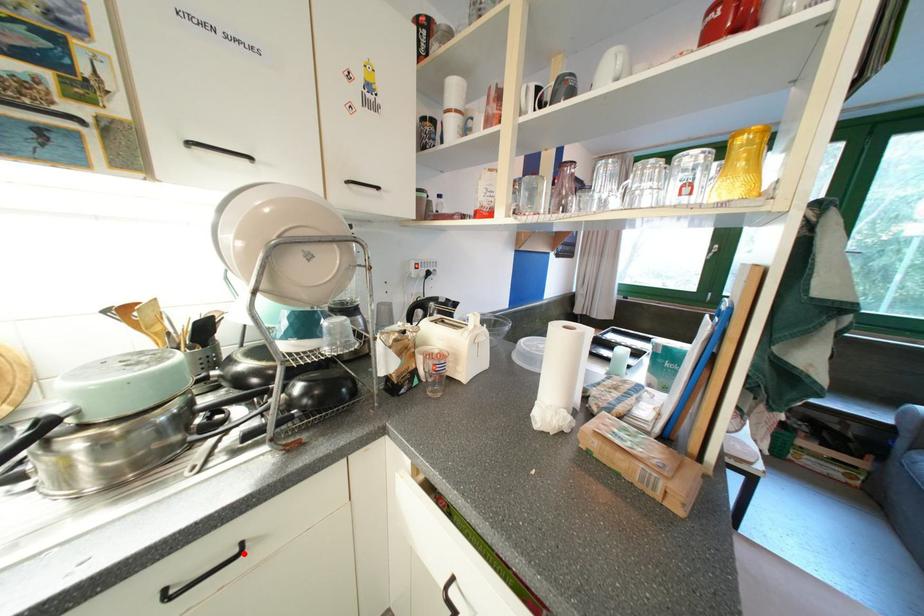
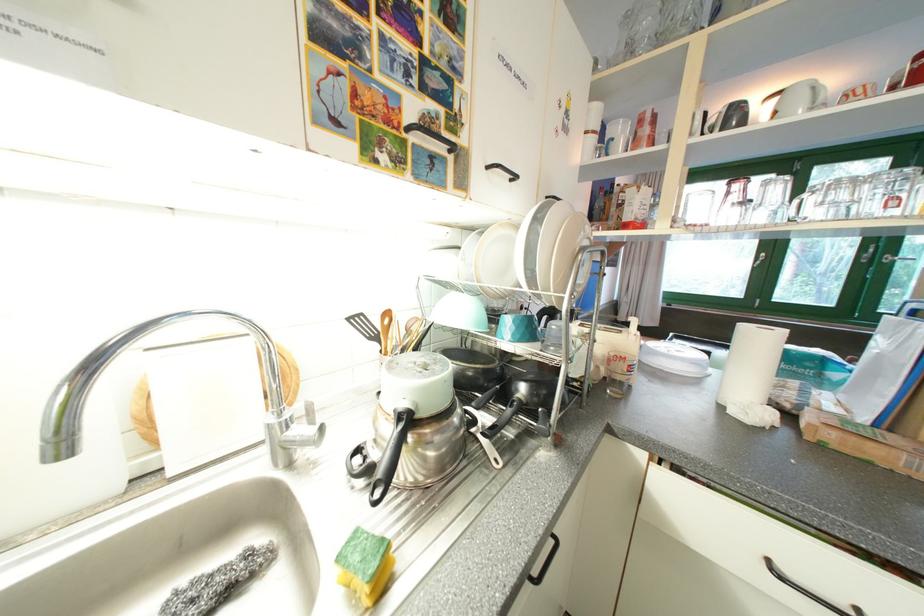
Question: I am providing you with two images of the same scene from different viewpoints. A red point is shown in image1. For the corresponding object point in image2, is it positioned nearer or farther from the camera?

Choices:
 (A) Nearer
 (B) Farther

Answer: (B)